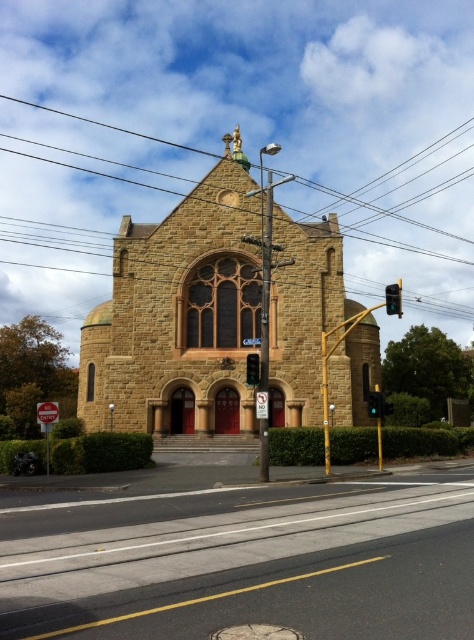
Question: Which of these objects is positioned farthest from the red glass traffic light at center?

Choices:
 (A) black plastic traffic light at center right
 (B) black wire at upper center

Answer: (B)

Question: Which object is the closest to the red glass traffic light at center?

Choices:
 (A) red plastic stop sign at center
 (B) golden stone church at center
 (C) black wire at upper center
 (D) black plastic traffic light at center right

Answer: (B)

Question: Does asphalt road at lower center come behind red plastic stop sign at center?

Choices:
 (A) no
 (B) yes

Answer: (A)

Question: Which of these objects is positioned closest to the black plastic traffic light at center right?

Choices:
 (A) golden stone church at center
 (B) red glass traffic light at center
 (C) red plastic stop sign at center
 (D) asphalt road at lower center

Answer: (B)

Question: Does asphalt road at lower center have a greater width compared to red plastic stop sign at center?

Choices:
 (A) yes
 (B) no

Answer: (A)

Question: Does asphalt road at lower center have a larger size compared to red glass traffic light at center?

Choices:
 (A) yes
 (B) no

Answer: (A)